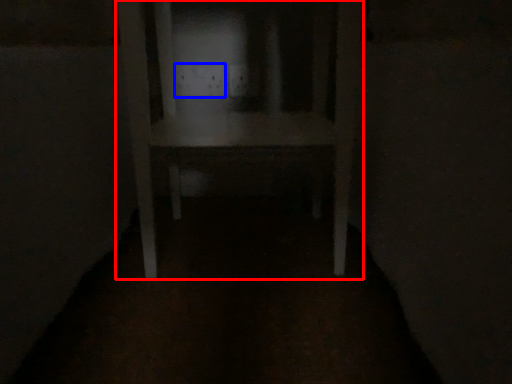
Question: Which object appears closest to the camera in this image, furniture (highlighted by a red box) or electric outlet (highlighted by a blue box)?

Choices:
 (A) furniture
 (B) electric outlet

Answer: (A)